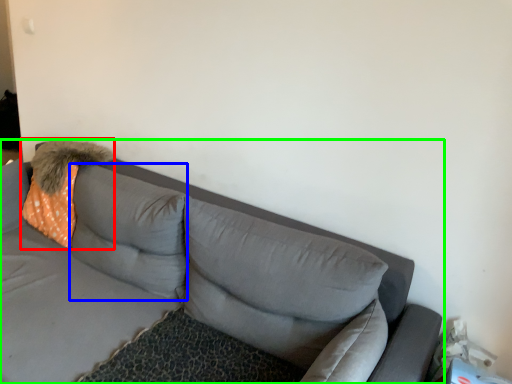
Question: Which object is positioned farthest from throw pillow (highlighted by a red box)? Select from pillow (highlighted by a blue box) and studio couch (highlighted by a green box).

Choices:
 (A) pillow
 (B) studio couch

Answer: (B)